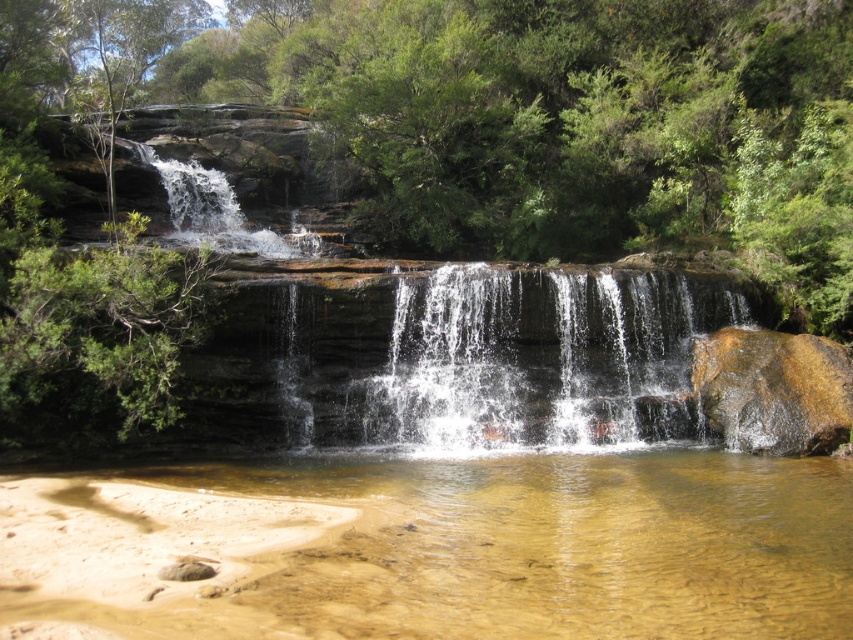
Question: Can you confirm if clear water at lower center is wider than brown rough rock at right?

Choices:
 (A) yes
 (B) no

Answer: (A)

Question: Which point is closer to the camera?

Choices:
 (A) brown rough rock at right
 (B) clear water at center

Answer: (A)

Question: Does clear water at center appear under brown rough rock at right?

Choices:
 (A) yes
 (B) no

Answer: (B)

Question: Which object is the closest to the clear water at center?

Choices:
 (A) brown rough rock at right
 (B) clear water at lower center

Answer: (A)

Question: Is clear water at lower center wider than brown rough rock at right?

Choices:
 (A) no
 (B) yes

Answer: (B)

Question: Which point is farther to the camera?

Choices:
 (A) (817, 516)
 (B) (766, 440)

Answer: (B)